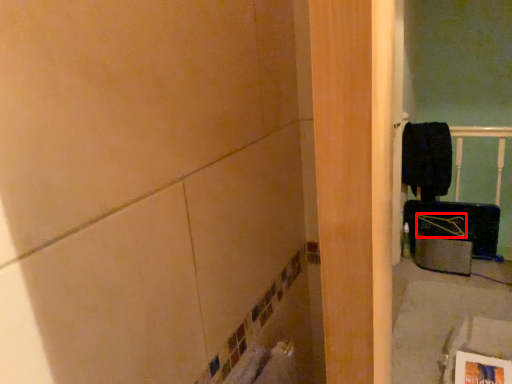
Question: From the image's perspective, what is the correct spatial positioning of job (annotated by the red box) in reference to laundry?

Choices:
 (A) above
 (B) below

Answer: (B)